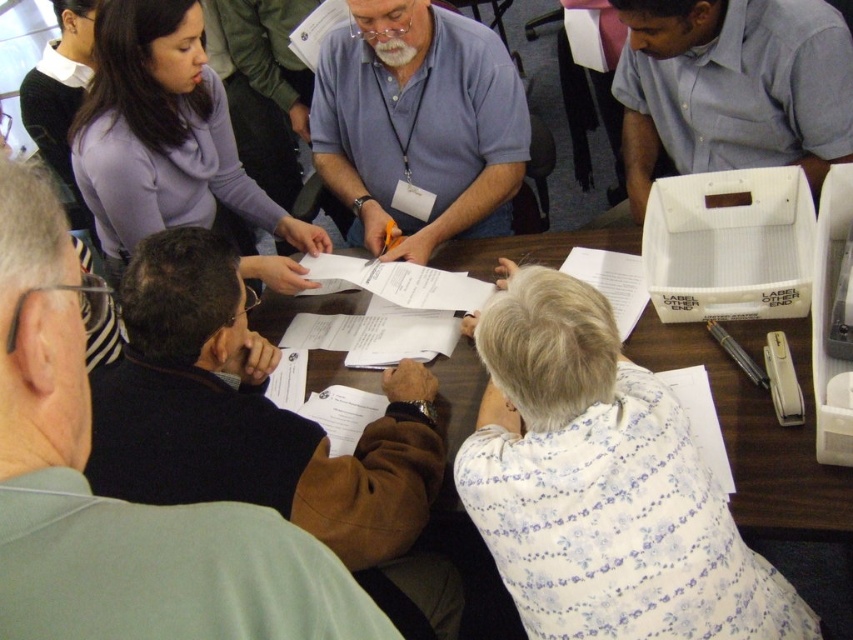
Question: Is light blue shirt at upper right below purple matte sweater at upper left?

Choices:
 (A) yes
 (B) no

Answer: (B)

Question: Is blue shirt at center below purple matte sweater at upper left?

Choices:
 (A) no
 (B) yes

Answer: (A)

Question: Which of the following is the farthest from the observer?

Choices:
 (A) 846,483
 (B) 59,500

Answer: (A)

Question: Estimate the real-world distances between objects in this image. Which object is farther from the purple matte sweater at upper left?

Choices:
 (A) blue shirt at center
 (B) light blue shirt at upper right
 (C) white floral blouse at lower center

Answer: (B)

Question: Which object is positioned farthest from the blue shirt at center?

Choices:
 (A) white floral blouse at lower center
 (B) wooden table at center

Answer: (A)

Question: Does dark brown leather jacket at lower left have a lesser width compared to light blue shirt at upper right?

Choices:
 (A) no
 (B) yes

Answer: (B)